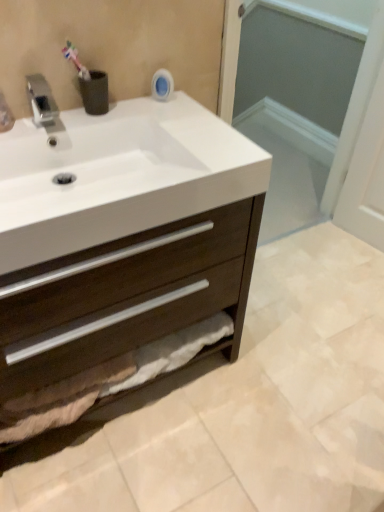
Image resolution: width=384 pixels, height=512 pixels. In order to click on vacant space to the right of silver metallic faucet at upper left in this screenshot , I will do `click(117, 114)`.